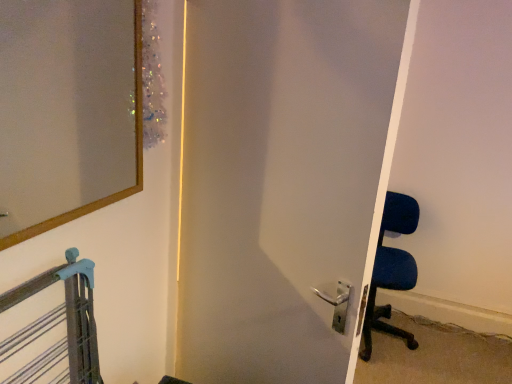
This screenshot has height=384, width=512. In order to click on blue fabric chair at right in this screenshot , I will do `click(391, 269)`.

What are the coordinates of `satin white door at center` in the screenshot? It's located at (x=283, y=182).

Is there a large distance between wooden-framed mirror at upper left and blue fabric chair at right?

Yes, wooden-framed mirror at upper left and blue fabric chair at right are located far from each other.

Relative to blue fabric chair at right, is wooden-framed mirror at upper left in front or behind?

Clearly, wooden-framed mirror at upper left is in front of blue fabric chair at right.

From a real-world perspective, who is located higher, wooden-framed mirror at upper left or blue fabric chair at right?

wooden-framed mirror at upper left.

Is wooden-framed mirror at upper left looking in the opposite direction of blue fabric chair at right?

That's not correct — wooden-framed mirror at upper left is not looking away from blue fabric chair at right.

From the image's perspective, is blue fabric chair at right above or below wooden-framed mirror at upper left?

From the image's perspective, blue fabric chair at right appears below wooden-framed mirror at upper left.

Is blue fabric chair at right positioned far away from wooden-framed mirror at upper left?

blue fabric chair at right is positioned a significant distance from wooden-framed mirror at upper left.

From the picture: Can we say blue fabric chair at right lies outside wooden-framed mirror at upper left?

Yes.

Is blue fabric chair at right to the left of wooden-framed mirror at upper left from the viewer's perspective?

No, blue fabric chair at right is not to the left of wooden-framed mirror at upper left.

From a real-world perspective, who is located lower, wooden-framed mirror at upper left or satin white door at center?

satin white door at center, from a real-world perspective.

Is point (24, 193) closer to viewer compared to point (353, 304)?

No, it is behind (353, 304).

Consider the image. Considering the relative sizes of wooden-framed mirror at upper left and satin white door at center in the image provided, is wooden-framed mirror at upper left smaller than satin white door at center?

Correct, wooden-framed mirror at upper left occupies less space than satin white door at center.

In the scene shown: Is wooden-framed mirror at upper left positioned behind satin white door at center?

No, wooden-framed mirror at upper left is in front of satin white door at center.

Who is shorter, satin white door at center or blue fabric chair at right?

blue fabric chair at right.

From a real-world perspective, between satin white door at center and blue fabric chair at right, who is vertically higher?

In real-world perspective, satin white door at center is above.

Can blue fabric chair at right be found inside satin white door at center?

No, blue fabric chair at right is not surrounded by satin white door at center.

Based on the photo, is satin white door at center to the left or to the right of blue fabric chair at right in the image?

From the image, it's evident that satin white door at center is to the left of blue fabric chair at right.

Is satin white door at center in front of wooden-framed mirror at upper left?

No, it is not.

Is satin white door at center situated inside wooden-framed mirror at upper left or outside?

satin white door at center lies outside wooden-framed mirror at upper left.

From the image's perspective, which one is positioned lower, satin white door at center or wooden-framed mirror at upper left?

satin white door at center.

Who is bigger, blue fabric chair at right or satin white door at center?

blue fabric chair at right is bigger.

Is point (392, 205) less distant than point (232, 364)?

No, (392, 205) is further to viewer.

From the image's perspective, relative to satin white door at center, is blue fabric chair at right above or below?

Clearly, from the image's perspective, blue fabric chair at right is below satin white door at center.

This screenshot has width=512, height=384. In order to click on chair on the right of wooden-framed mirror at upper left in this screenshot , I will do click(x=391, y=269).

The height and width of the screenshot is (384, 512). What are the coordinates of `chair below the wooden-framed mirror at upper left (from a real-world perspective)` in the screenshot? It's located at (391, 269).

Which object lies further to the anchor point satin white door at center, blue fabric chair at right or wooden-framed mirror at upper left?

Among the two, blue fabric chair at right is located further to satin white door at center.

Looking at this image, based on their spatial positions, is blue fabric chair at right or satin white door at center closer to wooden-framed mirror at upper left?

satin white door at center lies closer to wooden-framed mirror at upper left than the other object.

When comparing their distances from satin white door at center, does wooden-framed mirror at upper left or blue fabric chair at right seem further?

blue fabric chair at right is further to satin white door at center.

Based on their spatial positions, is satin white door at center or wooden-framed mirror at upper left further from blue fabric chair at right?

Among the two, wooden-framed mirror at upper left is located further to blue fabric chair at right.

Estimate the real-world distances between objects in this image. Which object is closer to blue fabric chair at right, wooden-framed mirror at upper left or satin white door at center?

The object closer to blue fabric chair at right is satin white door at center.

Based on their spatial positions, is satin white door at center or blue fabric chair at right closer to wooden-framed mirror at upper left?

satin white door at center is positioned closer to the anchor wooden-framed mirror at upper left.

The height and width of the screenshot is (384, 512). What are the coordinates of `door between wooden-framed mirror at upper left and blue fabric chair at right along the z-axis` in the screenshot? It's located at (283, 182).